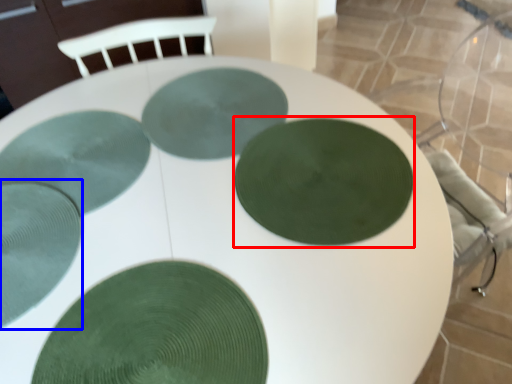
Question: Which object appears farthest to the camera in this image, glass plate (highlighted by a red box) or glass plate (highlighted by a blue box)?

Choices:
 (A) glass plate
 (B) glass plate

Answer: (A)